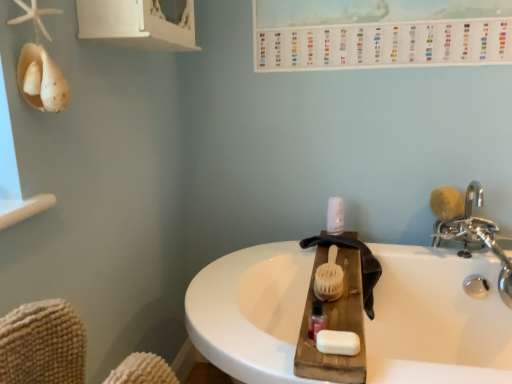
Question: In terms of width, does silver metallic faucet at upper right look wider or thinner when compared to white matte soap at center?

Choices:
 (A) thin
 (B) wide

Answer: (B)

Question: From a real-world perspective, relative to white matte soap at center, is silver metallic faucet at upper right vertically above or below?

Choices:
 (A) above
 (B) below

Answer: (B)

Question: Which of these objects is positioned closest to the pink glossy bottle at center?

Choices:
 (A) white plastic pump at center
 (B) yellow sponge at right, which is the 1th brush from top to bottom
 (C) silver metallic faucet at upper right
 (D) white bristle brush at center, the 2th brush when ordered from back to front
 (E) white matte soap at center

Answer: (E)

Question: Which is nearer to the white matte soap at center?

Choices:
 (A) yellow sponge at right, the 2th brush viewed from the left
 (B) white bristle brush at center, the 1th brush when ordered from bottom to top
 (C) silver metallic faucet at upper right
 (D) white plastic pump at center
 (E) pink glossy bottle at center

Answer: (E)